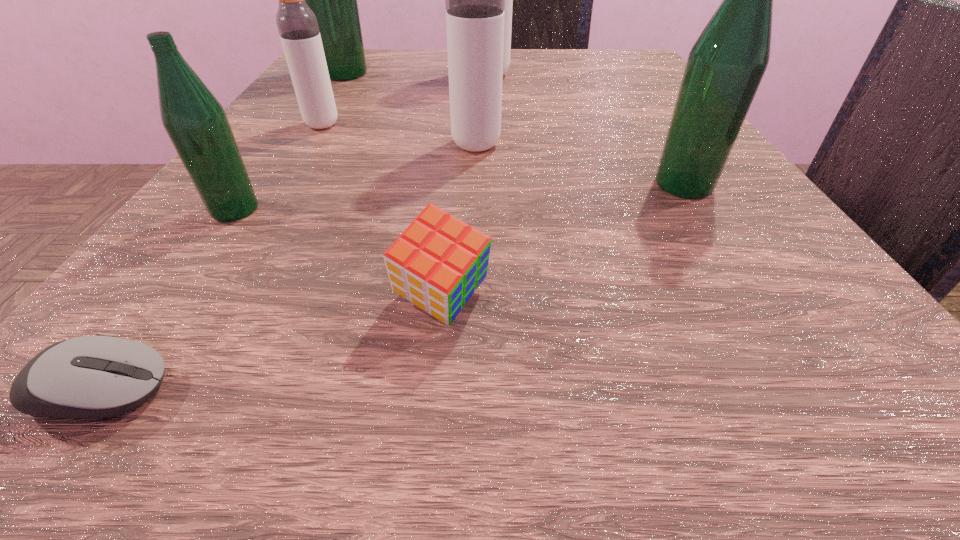
Where is `vacant position located 0.360m on the wheel side of the nearest object`? Image resolution: width=960 pixels, height=540 pixels. vacant position located 0.360m on the wheel side of the nearest object is located at coordinates (658, 390).

Find the location of `cube at the near edge`. cube at the near edge is located at coordinates (437, 263).

Locate an element on the screen. This screenshot has height=540, width=960. computer equipment located at the near edge is located at coordinates (100, 376).

Locate an element on the screen. computer equipment positioned at the left edge is located at coordinates (100, 376).

Locate an element on the screen. The image size is (960, 540). object positioned at the right edge is located at coordinates (725, 66).

The width and height of the screenshot is (960, 540). I want to click on object positioned at the far left corner, so click(x=333, y=0).

Locate an element on the screen. object that is at the near left corner is located at coordinates (100, 376).

The image size is (960, 540). In the image, there is a desktop. What are the coordinates of `free space at the far edge` in the screenshot? It's located at (422, 79).

This screenshot has height=540, width=960. I want to click on vacant space at the near edge of the desktop, so click(x=537, y=444).

Locate an element on the screen. The height and width of the screenshot is (540, 960). free space at the left edge of the desktop is located at coordinates (241, 308).